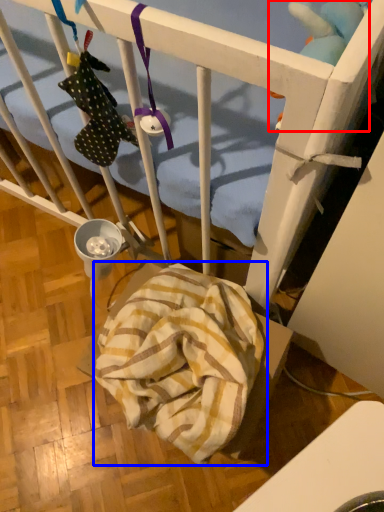
Question: Which object appears closest to the camera in this image, toy (highlighted by a red box) or blanket (highlighted by a blue box)?

Choices:
 (A) toy
 (B) blanket

Answer: (A)